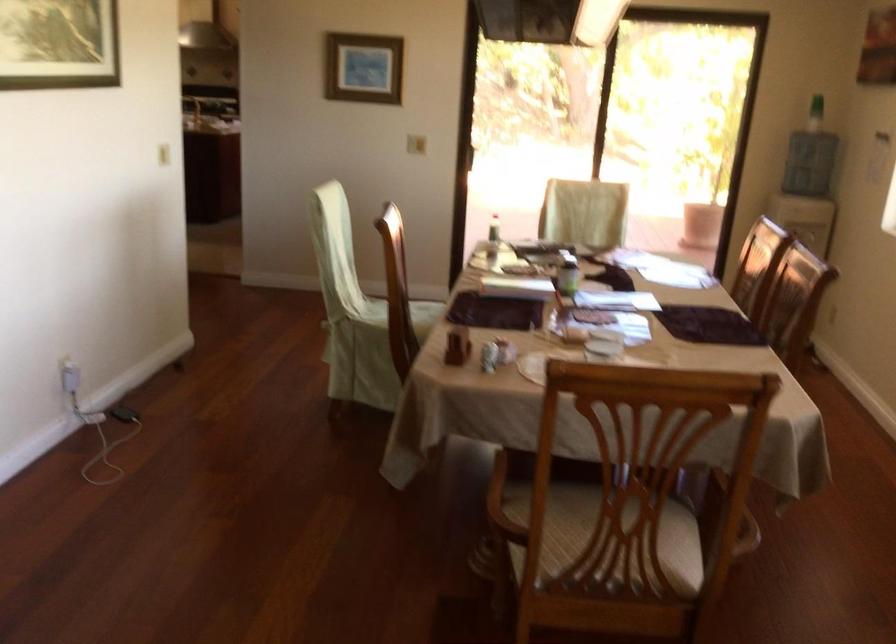
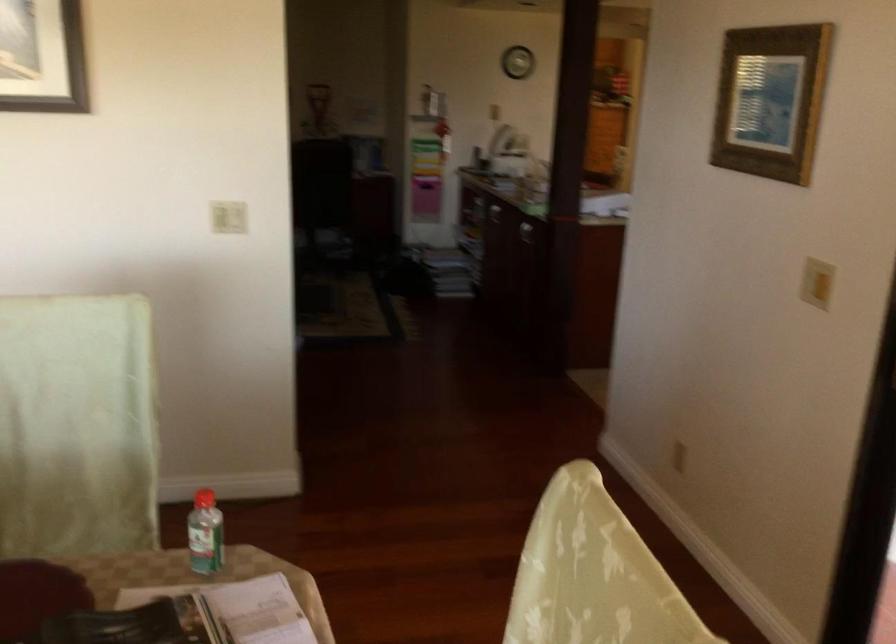
Where in the second image is the point corresponding to pixel 170 149 from the first image?

(228, 216)